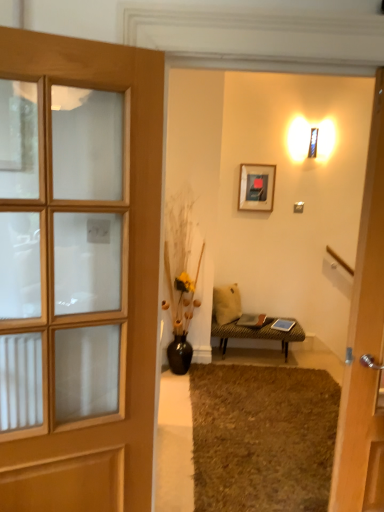
This screenshot has height=512, width=384. I want to click on free space in front of black ceramic vase at center, so click(173, 389).